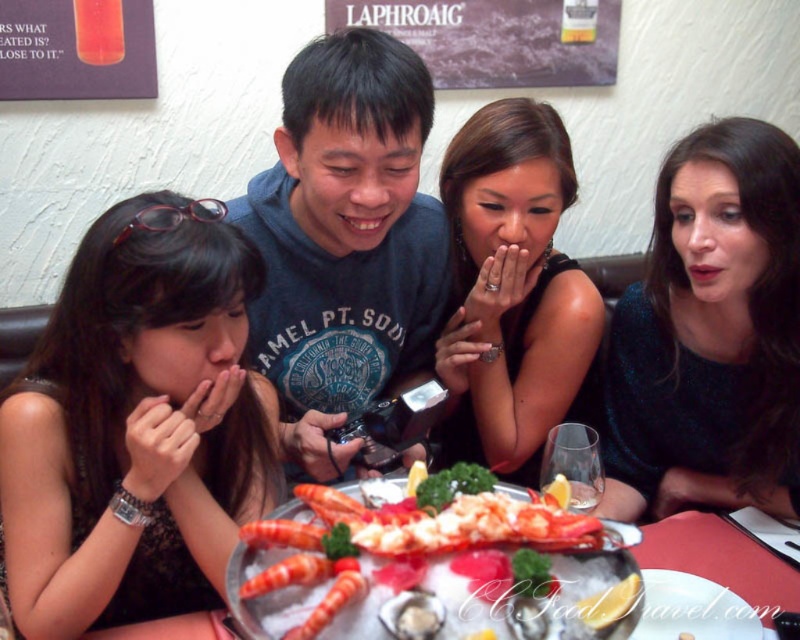
Question: Estimate the real-world distances between objects in this image. Which object is closer to the dark blue t-shirt at center?

Choices:
 (A) shiny red lobster at center
 (B) shiny silver tray at center
 (C) sparkly blue dress at right

Answer: (C)

Question: Is sparkly blue dress at right wider than black satin dress at center?

Choices:
 (A) yes
 (B) no

Answer: (A)

Question: Can you confirm if matte black dress at left is smaller than shiny red lobster at center?

Choices:
 (A) yes
 (B) no

Answer: (B)

Question: Estimate the real-world distances between objects in this image. Which object is farther from the shiny silver tray at center?

Choices:
 (A) matte black dress at left
 (B) black satin dress at center
 (C) white shell oyster at center
 (D) shiny red lobster at center

Answer: (A)

Question: Does sparkly blue dress at right appear under black satin dress at center?

Choices:
 (A) no
 (B) yes

Answer: (B)

Question: Among these points, which one is farthest from the camera?

Choices:
 (A) (770, 561)
 (B) (128, 531)

Answer: (A)